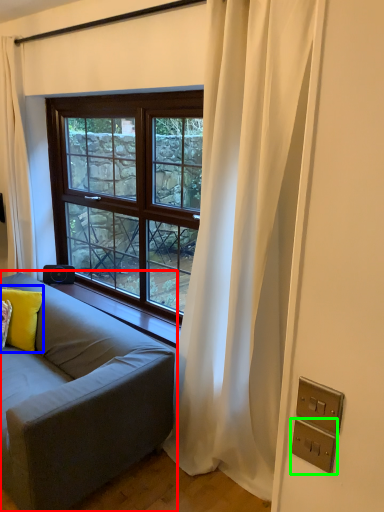
Question: Based on their relative distances, which object is farther from studio couch (highlighted by a red box)? Choose from pillow (highlighted by a blue box) and electric outlet (highlighted by a green box).

Choices:
 (A) pillow
 (B) electric outlet

Answer: (B)